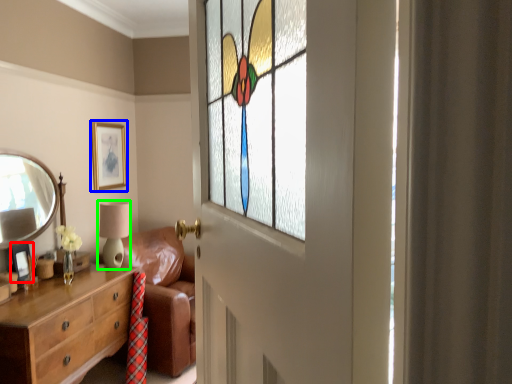
Question: Which object is the closest to the picture frame (highlighted by a red box)? Choose among these: picture frame (highlighted by a blue box) or table lamp (highlighted by a green box).

Choices:
 (A) picture frame
 (B) table lamp

Answer: (B)